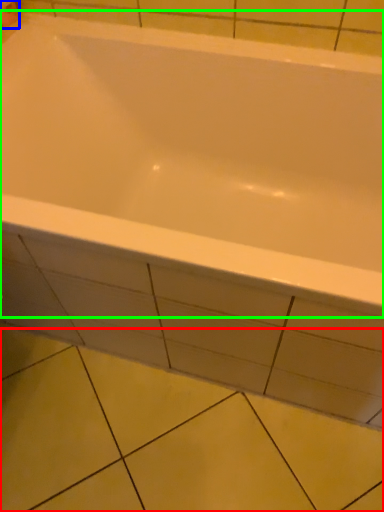
Question: Which object is the closest to the ceramic tile (highlighted by a red box)? Choose among these: toilet paper (highlighted by a blue box) or bathtub (highlighted by a green box).

Choices:
 (A) toilet paper
 (B) bathtub

Answer: (B)